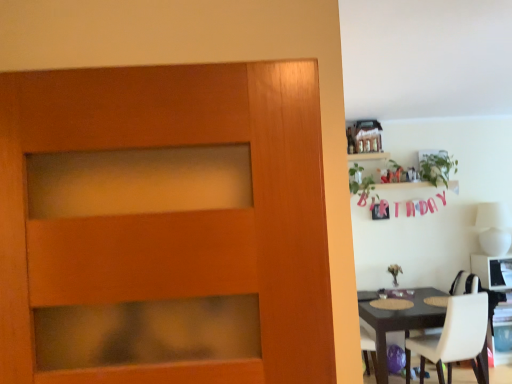
Question: Considering the positions of white leather chair at lower right and matte brown table at right in the image, is white leather chair at lower right bigger or smaller than matte brown table at right?

Choices:
 (A) small
 (B) big

Answer: (A)

Question: Visually, is white leather chair at lower right positioned to the left or to the right of matte brown table at right?

Choices:
 (A) right
 (B) left

Answer: (A)

Question: Estimate the real-world distances between objects in this image. Which object is farther from the white glossy computer desk at right?

Choices:
 (A) matte brown table at right
 (B) white leather chair at lower right
 (C) green leafy plant at upper right, which is the 2th plant from left to right
 (D) green leafy plant at upper right, which is the first plant in left-to-right order
 (E) wooden shelf at upper right

Answer: (E)

Question: Estimate the real-world distances between objects in this image. Which object is closer to the white glossy computer desk at right?

Choices:
 (A) white leather chair at lower right
 (B) matte brown table at right
 (C) wooden shelf at upper right
 (D) green leafy plant at upper right, which is counted as the first plant, starting from the right
 (E) green leafy plant at upper right, which is the first plant in left-to-right order

Answer: (B)